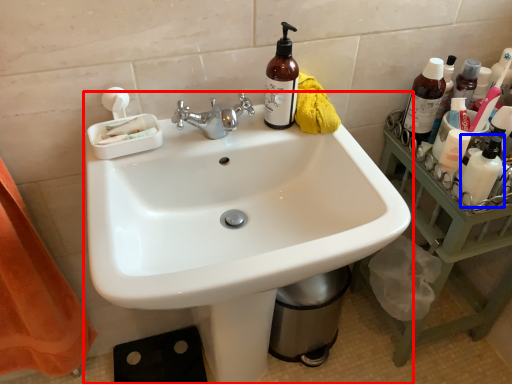
Question: Which of the following is the farthest to the observer, sink (highlighted by a red box) or toiletry (highlighted by a blue box)?

Choices:
 (A) sink
 (B) toiletry

Answer: (B)